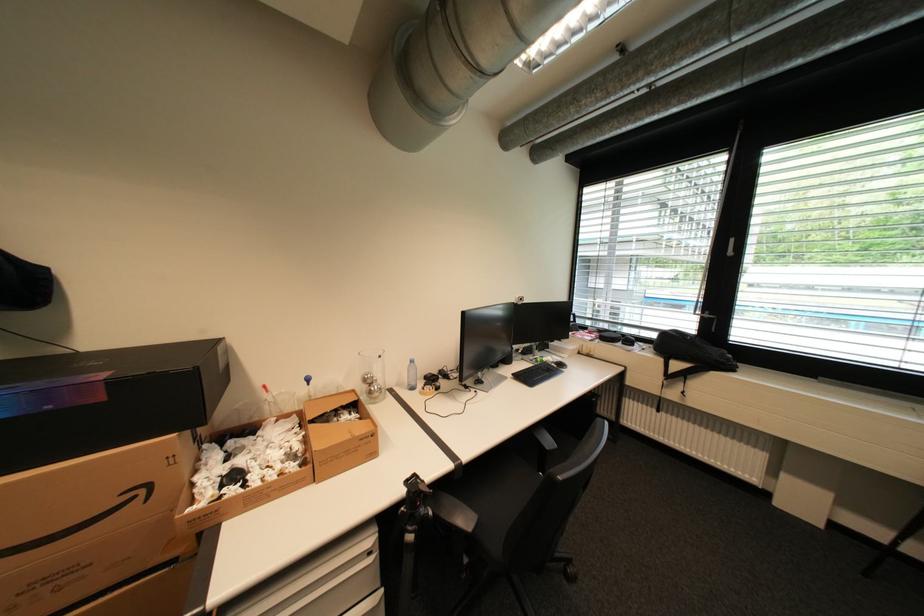
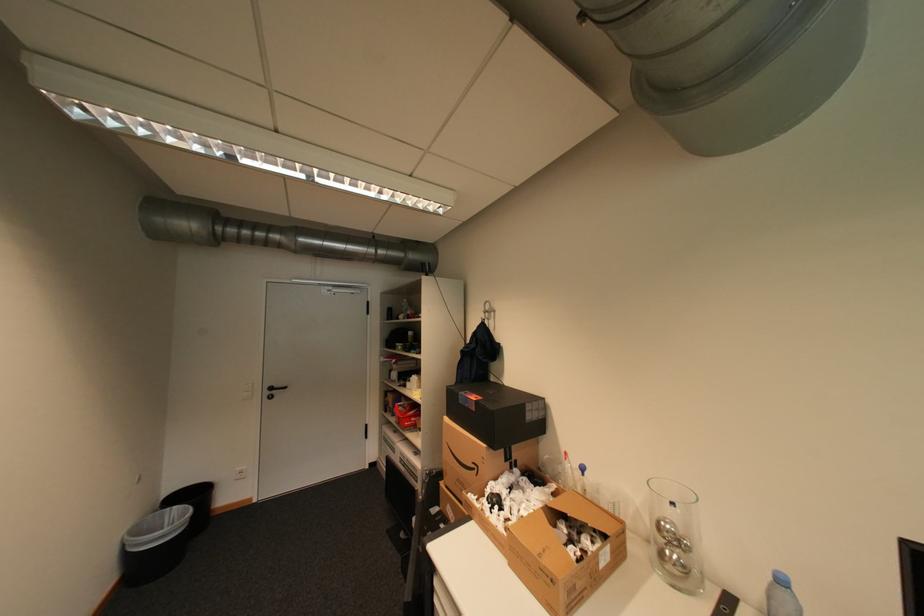
In the second image, find the point that corresponds to [151,491] in the first image.

(484, 468)